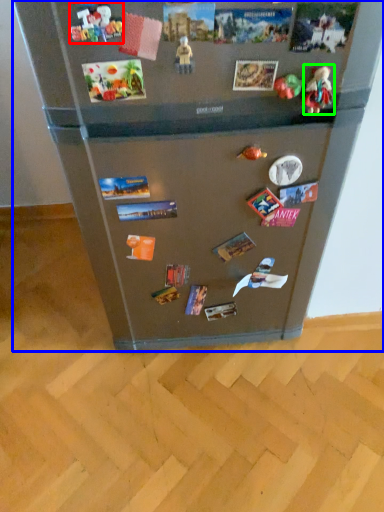
Question: Which is nearer to the toy (highlighted by a red box)? refrigerator (highlighted by a blue box) or toy (highlighted by a green box).

Choices:
 (A) refrigerator
 (B) toy

Answer: (B)